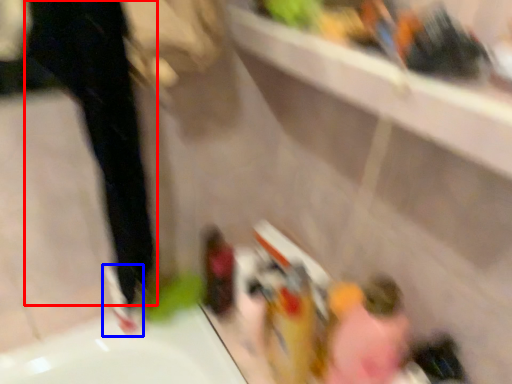
Question: Which of the following is the closest to the observer, pants (highlighted by a red box) or shoe (highlighted by a blue box)?

Choices:
 (A) pants
 (B) shoe

Answer: (A)